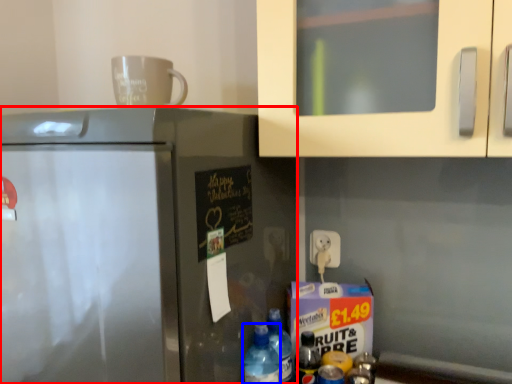
Question: Which object is closer to the camera taking this photo, refrigerator (highlighted by a red box) or bottle (highlighted by a blue box)?

Choices:
 (A) refrigerator
 (B) bottle

Answer: (A)